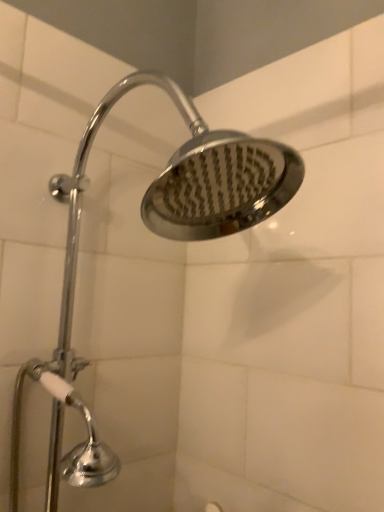
What is the approximate height of polished chrome shower head at upper center?

polished chrome shower head at upper center is 33.17 inches in height.

Identify the location of polished chrome shower head at upper center. (181, 191).

What do you see at coordinates (181, 191) in the screenshot? I see `polished chrome shower head at upper center` at bounding box center [181, 191].

Find the location of a particular element. The height and width of the screenshot is (512, 384). polished chrome shower head at upper center is located at coordinates (181, 191).